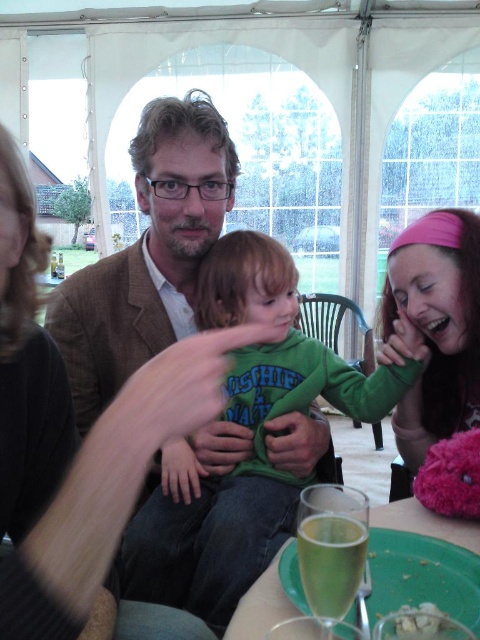
Question: Can you confirm if green cotton shirt at center is positioned above pink fabric headband at lower right?

Choices:
 (A) yes
 (B) no

Answer: (B)

Question: Based on their relative distances, which object is farther from the green cotton shirt at center?

Choices:
 (A) green plastic plate at lower center
 (B) pink fabric headband at lower right

Answer: (A)

Question: Considering the relative positions of pink fabric headband at lower right and green plastic plate at lower center in the image provided, where is pink fabric headband at lower right located with respect to green plastic plate at lower center?

Choices:
 (A) right
 (B) left

Answer: (A)

Question: Which point is closer to the camera?

Choices:
 (A) green plastic plate at lower center
 (B) green cotton shirt at center

Answer: (A)

Question: Which object is positioned farthest from the pink fabric headband at lower right?

Choices:
 (A) green cotton shirt at center
 (B) green plastic plate at lower center

Answer: (B)

Question: Can you confirm if pink fabric headband at lower right is bigger than green plastic plate at lower center?

Choices:
 (A) no
 (B) yes

Answer: (B)